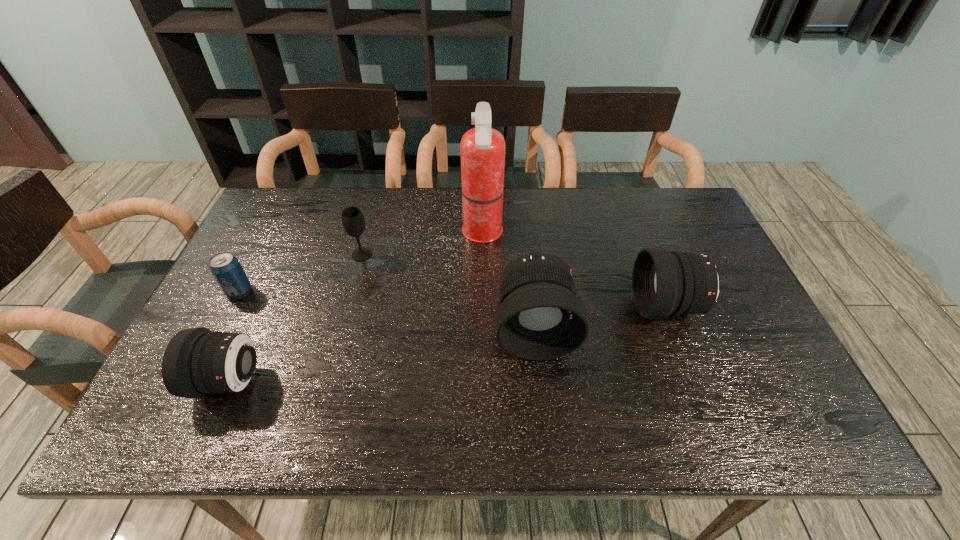
Find the location of a particular element. telephoto lens that can be found as the second closest to the tallest object is located at coordinates (664, 283).

Where is `telephoto lens that stands as the closest to the second shortest telephoto lens`? telephoto lens that stands as the closest to the second shortest telephoto lens is located at coordinates (540, 317).

Image resolution: width=960 pixels, height=540 pixels. I want to click on free space in the image that satisfies the following two spatial constraints: 1. at the front element of the second telephoto lens from right to left; 2. at the front element of the shortest telephoto lens, so click(540, 381).